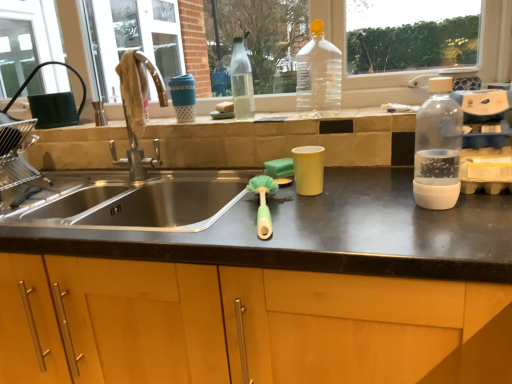
Identify the location of vacant space that is to the left of green rubber brush at center. The height and width of the screenshot is (384, 512). (199, 226).